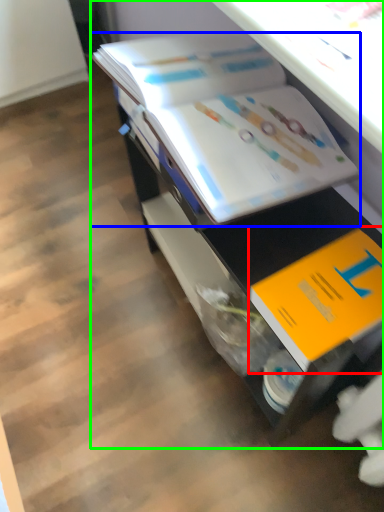
Question: Based on their relative distances, which object is farther from book (highlighted by a red box)? Choose from book (highlighted by a blue box) and desk (highlighted by a green box).

Choices:
 (A) book
 (B) desk

Answer: (A)